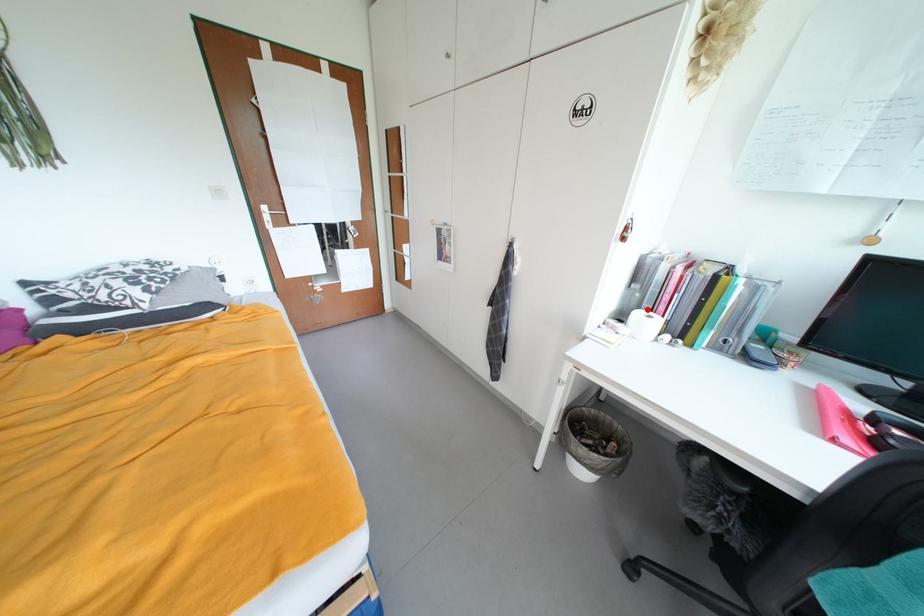
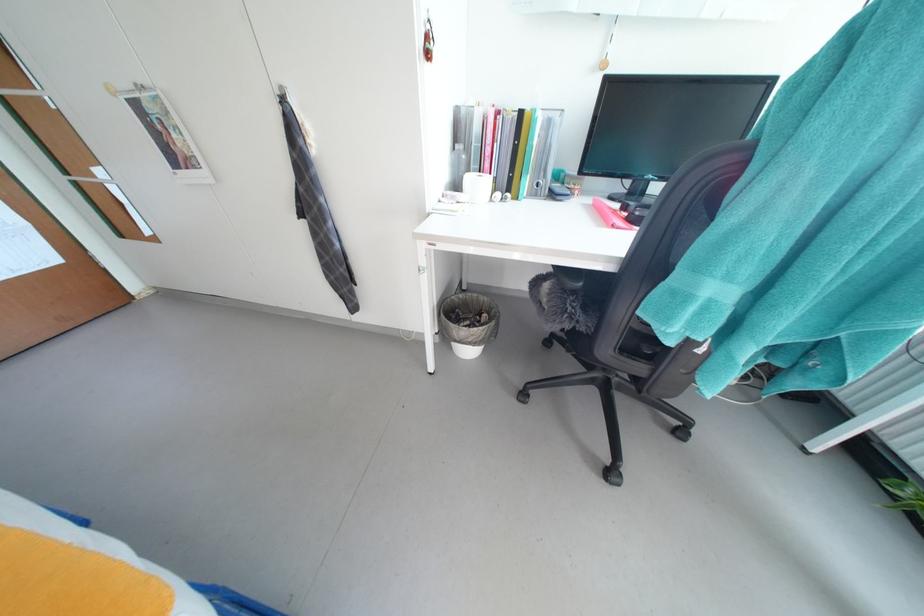
Where in the second image is the point corresponding to the highlighted location from the first image?

(477, 172)